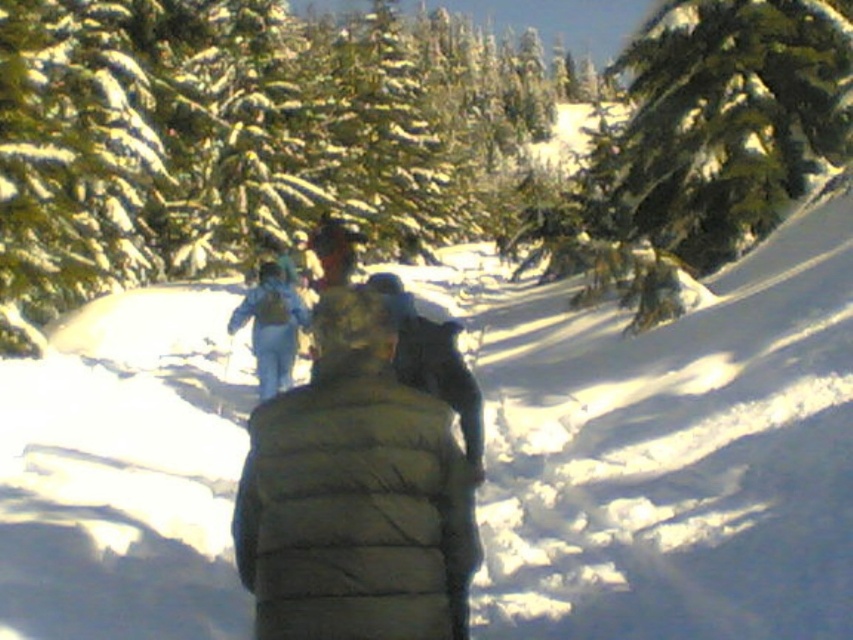
Consider the image. You are standing in the snowy forest and want to take a photo of both the green textured pine tree at center and the green textured pine tree at upper right. Can you position yourself so that both trees are visible in the frame without one blocking the other?

The green textured pine tree at upper right is behind the green textured pine tree at center, so positioning yourself to see both without one blocking the other may be challenging. You might need to move to a different angle where the trees are not aligned in depth.

You are standing at the starting point of the snow path and want to reach the green textured pine tree at upper right. Which direction should you head towards?

The green textured pine tree at upper right is located at point (705, 145), so you should head towards the upper right direction to reach it.